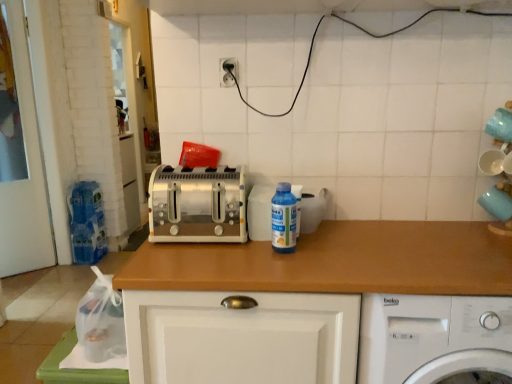
What is the approximate width of white plastic washing machine at lower right?

The width of white plastic washing machine at lower right is 20.70 inches.

The image size is (512, 384). Find the location of `wooden at center`. wooden at center is located at coordinates (337, 262).

Where is `transparent plastic bottle at center`? transparent plastic bottle at center is located at coordinates (283, 219).

Are transparent plastic bottle at center and wooden at center making contact?

There is a gap between transparent plastic bottle at center and wooden at center.

What's the angular difference between transparent plastic bottle at center and wooden at center's facing directions?

They differ by 0.64 degrees in their facing directions.

Is transparent plastic bottle at center oriented away from wooden at center?

transparent plastic bottle at center is not turned away from wooden at center.

Measure the distance from transparent plastic bottle at center to wooden at center.

transparent plastic bottle at center is 24.97 centimeters from wooden at center.

Is satin silver toaster at center placed right next to white plastic electric outlet at upper center?

satin silver toaster at center is not next to white plastic electric outlet at upper center, and they're not touching.

Can you tell me how much satin silver toaster at center and white plastic electric outlet at upper center differ in facing direction?

2.93 degrees separate the facing orientations of satin silver toaster at center and white plastic electric outlet at upper center.

Is point (239, 225) closer or farther from the camera than point (229, 85)?

Clearly, point (239, 225) is closer to the camera than point (229, 85).

Is satin silver toaster at center positioned beyond the bounds of white plastic electric outlet at upper center?

That's correct, satin silver toaster at center is outside of white plastic electric outlet at upper center.

Considering the points (239, 219) and (332, 246), which point is behind, point (239, 219) or point (332, 246)?

The point (239, 219) is farther from the camera.

Measure the distance from satin silver toaster at center to wooden at center.

satin silver toaster at center and wooden at center are 9.25 inches apart.

Is satin silver toaster at center not within wooden at center?

satin silver toaster at center is positioned outside wooden at center.

I want to click on toaster located behind the wooden at center, so click(x=197, y=204).

Considering the relative sizes of white plastic electric outlet at upper center and satin silver toaster at center in the image provided, is white plastic electric outlet at upper center wider than satin silver toaster at center?

No.

Is white plastic electric outlet at upper center positioned before satin silver toaster at center?

No, it is not.

How many degrees apart are the facing directions of white plastic electric outlet at upper center and satin silver toaster at center?

The facing directions of white plastic electric outlet at upper center and satin silver toaster at center are 2.93 degrees apart.

Is white plastic electric outlet at upper center taller or shorter than satin silver toaster at center?

Considering their sizes, white plastic electric outlet at upper center has less height than satin silver toaster at center.

Looking at this image, is white plastic washing machine at lower right positioned in front of white plastic electric outlet at upper center?

Yes, white plastic washing machine at lower right is closer to the camera.

Considering the positions of objects white plastic washing machine at lower right and white plastic electric outlet at upper center in the image provided, who is more to the left, white plastic washing machine at lower right or white plastic electric outlet at upper center?

white plastic electric outlet at upper center.

Considering the relative sizes of white plastic washing machine at lower right and white plastic electric outlet at upper center in the image provided, is white plastic washing machine at lower right smaller than white plastic electric outlet at upper center?

No, white plastic washing machine at lower right is not smaller than white plastic electric outlet at upper center.

Consider the image. Is white plastic electric outlet at upper center inside or outside of transparent plastic bottle at center?

white plastic electric outlet at upper center is not inside transparent plastic bottle at center, it's outside.

From a real-world perspective, is white plastic electric outlet at upper center physically above transparent plastic bottle at center?

Yes, from a real-world perspective, white plastic electric outlet at upper center is over transparent plastic bottle at center

Is white plastic electric outlet at upper center wider or thinner than transparent plastic bottle at center?

Clearly, white plastic electric outlet at upper center has less width compared to transparent plastic bottle at center.

Is white plastic electric outlet at upper center smaller than transparent plastic bottle at center?

Yes.

Can you confirm if white plastic washing machine at lower right is positioned to the right of transparent plastic bottle at center?

Indeed, white plastic washing machine at lower right is positioned on the right side of transparent plastic bottle at center.

From the image's perspective, is white plastic washing machine at lower right on transparent plastic bottle at center?

No, from the image's perspective, white plastic washing machine at lower right is not above transparent plastic bottle at center.

Considering the sizes of white plastic washing machine at lower right and transparent plastic bottle at center in the image, is white plastic washing machine at lower right wider or thinner than transparent plastic bottle at center?

In the image, white plastic washing machine at lower right appears to be wider than transparent plastic bottle at center.

Is white plastic washing machine at lower right completely or partially outside of transparent plastic bottle at center?

Indeed, white plastic washing machine at lower right is completely outside transparent plastic bottle at center.

The image size is (512, 384). Find the location of `bottle behind the wooden at center`. bottle behind the wooden at center is located at coordinates (283, 219).

This screenshot has height=384, width=512. In order to click on electric outlet located above the satin silver toaster at center (from the image's perspective) in this screenshot , I will do `click(228, 71)`.

Which object lies nearer to the anchor point white plastic washing machine at lower right, white plastic electric outlet at upper center or transparent plastic bottle at center?

transparent plastic bottle at center is positioned closer to the anchor white plastic washing machine at lower right.

From the image, which object appears to be nearer to white plastic washing machine at lower right, wooden at center or transparent plastic bottle at center?

wooden at center lies closer to white plastic washing machine at lower right than the other object.

Looking at the image, which one is located further to white plastic electric outlet at upper center, satin silver toaster at center or transparent plastic bottle at center?

Among the two, transparent plastic bottle at center is located further to white plastic electric outlet at upper center.

Looking at the image, which one is located further to transparent plastic bottle at center, white plastic electric outlet at upper center or satin silver toaster at center?

Based on the image, white plastic electric outlet at upper center appears to be further to transparent plastic bottle at center.

Estimate the real-world distances between objects in this image. Which object is closer to white plastic electric outlet at upper center, transparent plastic bottle at center or wooden at center?

transparent plastic bottle at center is closer to white plastic electric outlet at upper center.

When comparing their distances from satin silver toaster at center, does wooden at center or white plastic washing machine at lower right seem closer?

wooden at center.

Estimate the real-world distances between objects in this image. Which object is further from white plastic washing machine at lower right, satin silver toaster at center or transparent plastic bottle at center?

satin silver toaster at center lies further to white plastic washing machine at lower right than the other object.

Considering their positions, is wooden at center positioned further to satin silver toaster at center than white plastic electric outlet at upper center?

white plastic electric outlet at upper center lies further to satin silver toaster at center than the other object.

At what (x,y) coordinates should I click in order to perform the action: click on countertop between satin silver toaster at center and white plastic washing machine at lower right. Please return your answer as a coordinate pair (x, y). Image resolution: width=512 pixels, height=384 pixels. Looking at the image, I should click on (337, 262).

At what (x,y) coordinates should I click in order to perform the action: click on toaster that lies between white plastic electric outlet at upper center and white plastic washing machine at lower right from top to bottom. Please return your answer as a coordinate pair (x, y). Looking at the image, I should click on (197, 204).

Find the location of `bottle between white plastic electric outlet at upper center and white plastic washing machine at lower right in the vertical direction`. bottle between white plastic electric outlet at upper center and white plastic washing machine at lower right in the vertical direction is located at coordinates (283, 219).

Where is `toaster between white plastic electric outlet at upper center and transparent plastic bottle at center from top to bottom`? The width and height of the screenshot is (512, 384). toaster between white plastic electric outlet at upper center and transparent plastic bottle at center from top to bottom is located at coordinates (197, 204).